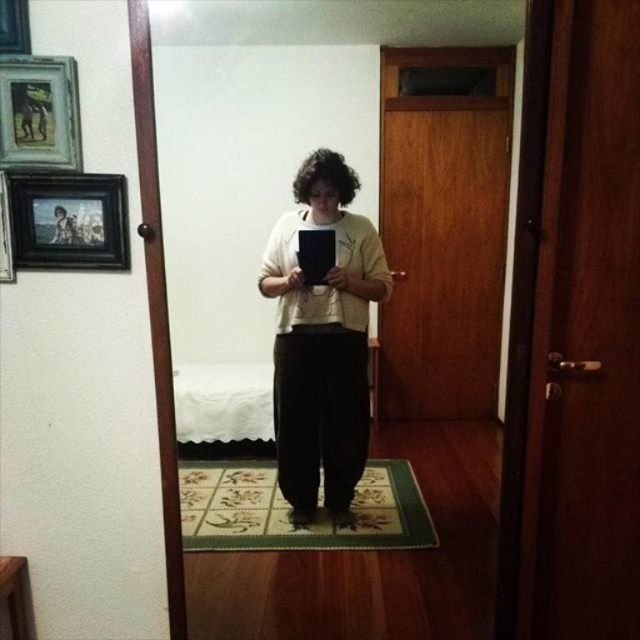
You are an interior designer assessing the placement of two frames in a room. You see the black glossy picture frame at upper left and the black matte picture frame at upper left. Which frame has a greater width?

The black glossy picture frame at upper left has a greater width than the black matte picture frame at upper left according to the description.

You are standing in the doorway and see a point marked at coordinates [68,220]. What object is located at that point?

The point at coordinates [68,220] marks the location of the black glossy picture frame at upper left.

You are standing in the doorway and want to hang a new picture on the wall between the wooden framed picture at upper left and the black matte picture frame at upper left. Which picture should you move first to make space?

You should move the wooden framed picture at upper left first because it is closer to the viewer than the black matte picture frame at upper left, so it can be adjusted to create space between them.